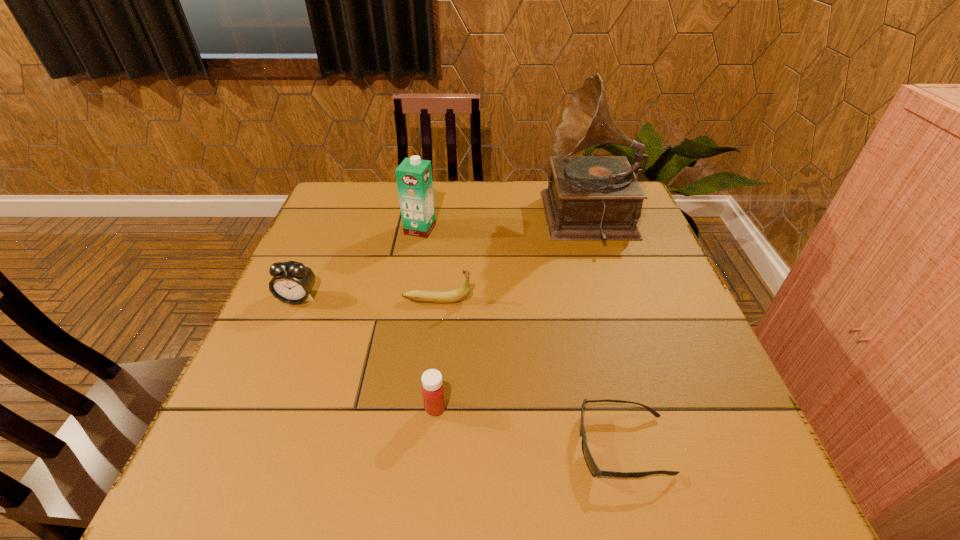
Find the location of a particular element. This screenshot has width=960, height=540. blank space located 0.240m on the front side of the alarm clock is located at coordinates (255, 396).

The height and width of the screenshot is (540, 960). Find the location of `free space located at the stem of the banana`. free space located at the stem of the banana is located at coordinates (606, 300).

The width and height of the screenshot is (960, 540). I want to click on free space located 0.190m on the left of the medicine, so click(x=324, y=408).

Locate an element on the screen. The image size is (960, 540). blank space located on the front-facing side of the shortest object is located at coordinates (477, 446).

Identify the location of vacant area situated 0.360m on the front-facing side of the shortest object. (374, 446).

Locate an element on the screen. The height and width of the screenshot is (540, 960). vacant point located 0.160m on the front-facing side of the shortest object is located at coordinates (488, 446).

You are a GUI agent. You are given a task and a screenshot of the screen. Output one action in this format:
    pyautogui.click(x=<x>, y=<y>)
    Task: Click on the record player that is at the far edge
    The image size is (960, 540).
    Given the screenshot: What is the action you would take?
    pyautogui.click(x=589, y=198)

Where is `carton present at the far edge`? The image size is (960, 540). carton present at the far edge is located at coordinates (414, 176).

Where is `object that is at the near edge`? Image resolution: width=960 pixels, height=540 pixels. object that is at the near edge is located at coordinates click(593, 468).

What are the coordinates of `object that is positioned at the left edge` in the screenshot? It's located at (292, 282).